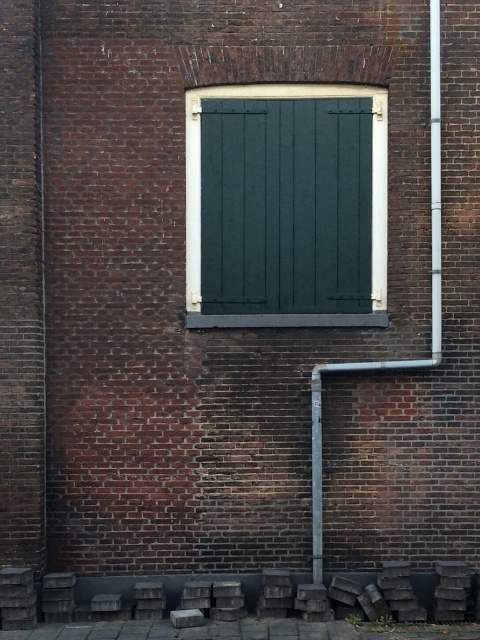
Does dark green wood at center have a lesser height compared to metallic gray pole at center?

No, dark green wood at center is not shorter than metallic gray pole at center.

Which is more to the right, dark green wood at center or metallic gray pole at center?

metallic gray pole at center is more to the right.

Is point (371, 252) in front of point (312, 550)?

That is False.

This screenshot has height=640, width=480. Find the location of `dark green wood at center`. dark green wood at center is located at coordinates (286, 205).

Does point (264, 285) come farther from viewer compared to point (441, 266)?

Yes, point (264, 285) is farther from viewer.

Locate an element on the screen. The image size is (480, 640). dark green wood at center is located at coordinates (286, 205).

In the scene shown: Can you confirm if white metallic pipe at right is positioned below metallic gray pole at center?

No, white metallic pipe at right is not below metallic gray pole at center.

Is white metallic pipe at right smaller than metallic gray pole at center?

Incorrect, white metallic pipe at right is not smaller in size than metallic gray pole at center.

Who is more forward, (431, 90) or (319, 490)?

Point (319, 490) is in front.

Image resolution: width=480 pixels, height=640 pixels. Find the location of `white metallic pipe at right`. white metallic pipe at right is located at coordinates (434, 186).